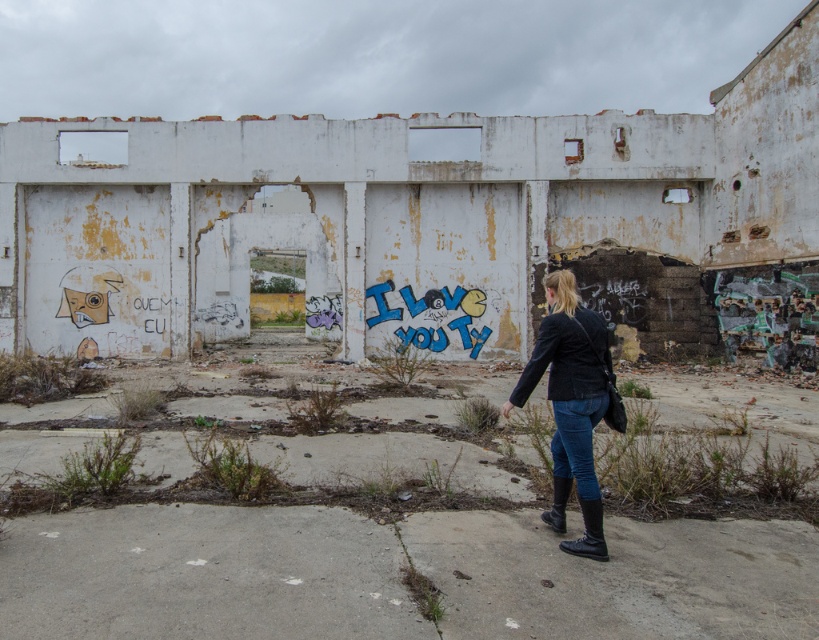
Question: Which of the following is the farthest from the observer?

Choices:
 (A) black leather boot at lower right
 (B) black rubber boot at lower right
 (C) black leather jacket at lower right

Answer: (B)

Question: Is black leather jacket at lower right in front of black rubber boot at lower right?

Choices:
 (A) yes
 (B) no

Answer: (A)

Question: Does black leather boot at lower right come behind black rubber boot at lower right?

Choices:
 (A) no
 (B) yes

Answer: (A)

Question: Which object appears closest to the camera in this image?

Choices:
 (A) black leather jacket at lower right
 (B) black rubber boot at lower right
 (C) black leather boot at lower right

Answer: (C)

Question: Which object is farther from the camera taking this photo?

Choices:
 (A) black leather jacket at lower right
 (B) black rubber boot at lower right

Answer: (B)

Question: Does black leather boot at lower right have a greater width compared to black rubber boot at lower right?

Choices:
 (A) no
 (B) yes

Answer: (B)